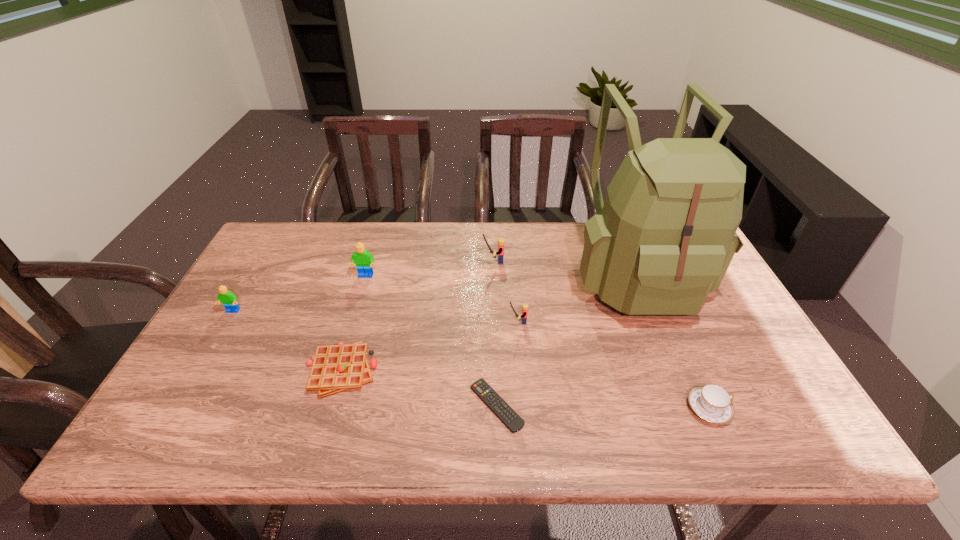
Where is `vacant area located on the front-facing side of the smaller yellow Lego`? vacant area located on the front-facing side of the smaller yellow Lego is located at coordinates (363, 322).

Locate an element on the screen. This screenshot has height=540, width=960. vacant position located on the front-facing side of the smaller yellow Lego is located at coordinates (486, 322).

The image size is (960, 540). In order to click on free space located on the face of the smaller green Lego in this screenshot , I will do `click(216, 340)`.

Locate an element on the screen. blank space located 0.110m on the side with the handle of the teacup is located at coordinates (780, 408).

At what (x,y) coordinates should I click in order to perform the action: click on free location located on the back of the seventh tallest object. Please return your answer as a coordinate pair (x, y). Looking at the image, I should click on (353, 329).

Where is `free space located 0.250m on the left of the remote control`? This screenshot has height=540, width=960. free space located 0.250m on the left of the remote control is located at coordinates (359, 406).

Find the location of a particular element. This screenshot has width=960, height=540. backpack present at the far edge is located at coordinates (664, 237).

This screenshot has width=960, height=540. What are the coordinates of `Lego that is at the far edge` in the screenshot? It's located at click(x=501, y=241).

Where is `teacup present at the near edge`? teacup present at the near edge is located at coordinates (711, 402).

Where is `remote control that is at the near edge`? The image size is (960, 540). remote control that is at the near edge is located at coordinates (481, 388).